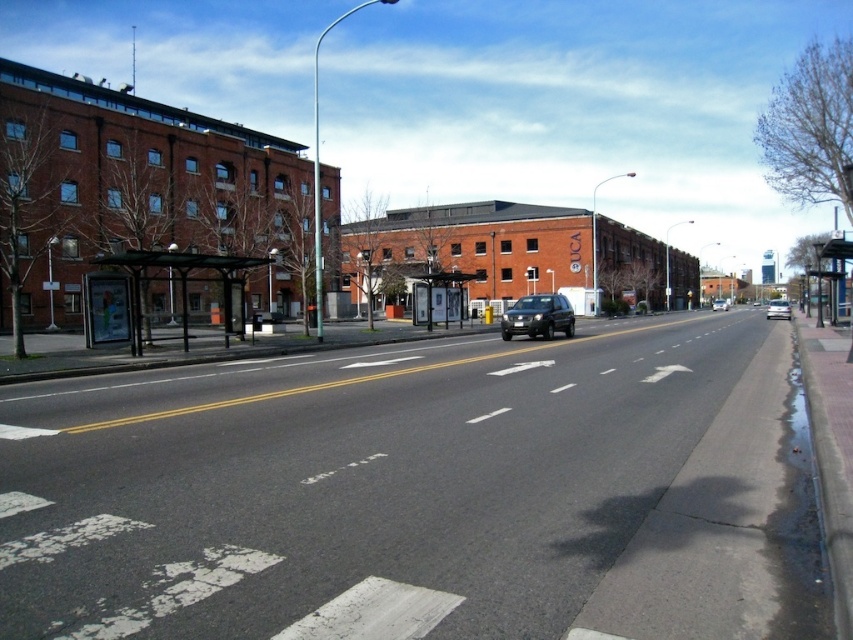
Question: Based on their relative distances, which object is nearer to the transparent plastic bus stop at lower left?

Choices:
 (A) matte black suv at center
 (B) white glossy sedan at right

Answer: (B)

Question: Is satin black suv at center closer to camera compared to white glossy sedan at right?

Choices:
 (A) yes
 (B) no

Answer: (A)

Question: Which object is positioned closest to the satin black suv at center?

Choices:
 (A) matte black suv at center
 (B) transparent plastic bus stop at lower left

Answer: (B)

Question: Considering the relative positions of satin black suv at center and white glossy sedan at right in the image provided, where is satin black suv at center located with respect to white glossy sedan at right?

Choices:
 (A) below
 (B) above

Answer: (A)

Question: Which of the following is the closest to the observer?

Choices:
 (A) white glossy sedan at right
 (B) satin black suv at center
 (C) transparent plastic bus stop at lower left
 (D) matte black suv at center

Answer: (C)

Question: Observing the image, what is the correct spatial positioning of transparent plastic bus stop at lower left in reference to satin black suv at center?

Choices:
 (A) right
 (B) left

Answer: (B)